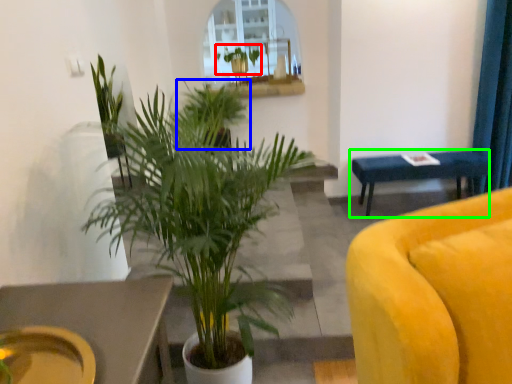
Question: Based on their relative distances, which object is farther from houseplant (highlighted by a red box)? Choose from houseplant (highlighted by a blue box) and table (highlighted by a green box).

Choices:
 (A) houseplant
 (B) table

Answer: (B)